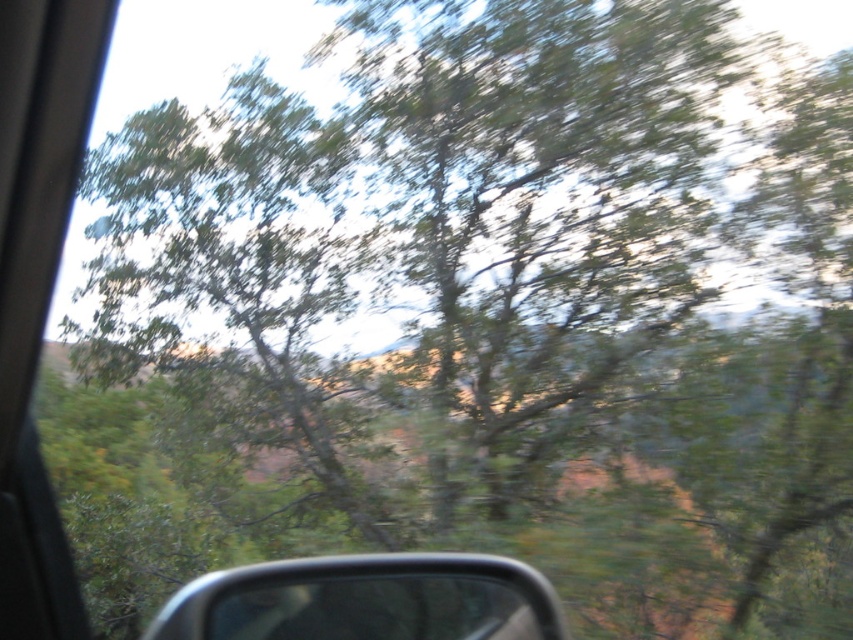
Question: Can you confirm if green leafy tree at center is thinner than metallic gray side mirror at lower center?

Choices:
 (A) yes
 (B) no

Answer: (B)

Question: Is green leafy tree at center smaller than metallic gray side mirror at lower center?

Choices:
 (A) no
 (B) yes

Answer: (A)

Question: Which of the following is the closest to the observer?

Choices:
 (A) metallic gray side mirror at lower center
 (B) green leafy tree at center

Answer: (A)

Question: Which of the following is the farthest from the observer?

Choices:
 (A) metallic gray side mirror at lower center
 (B) green leafy tree at center

Answer: (B)

Question: Is the position of green leafy tree at center more distant than that of metallic gray side mirror at lower center?

Choices:
 (A) no
 (B) yes

Answer: (B)